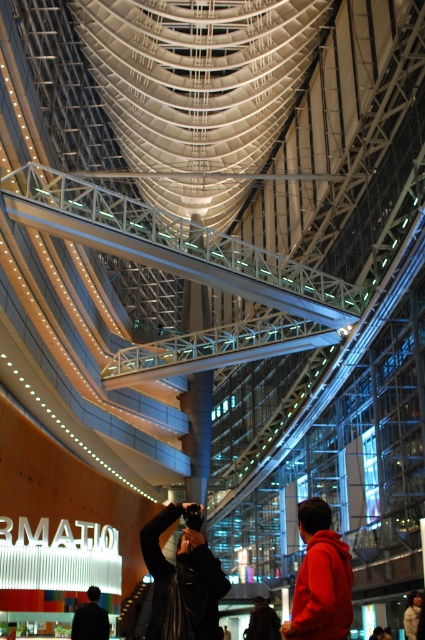
In the image of the modern building interior with curved metallic beams and two people, where is the red fleece jacket at center located in terms of coordinates?

The red fleece jacket at center is located at coordinates point (320,579).

You are a photographer trying to capture a photo of both the dark blue jacket at lower left and the dark brown leather jacket at lower center in the same frame. Based on their positions, which jacket will appear closer to the bottom edge of your photo?

The dark blue jacket at lower left will appear closer to the bottom edge of the photo because it is positioned lower than the dark brown leather jacket at lower center.